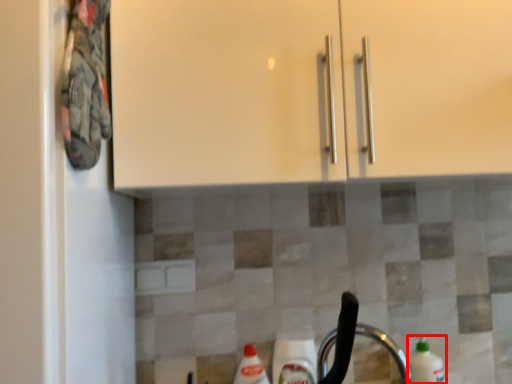
Question: From the image, what is the correct spatial relationship of cleaning product (annotated by the red box) in relation to faucet?

Choices:
 (A) right
 (B) left

Answer: (A)